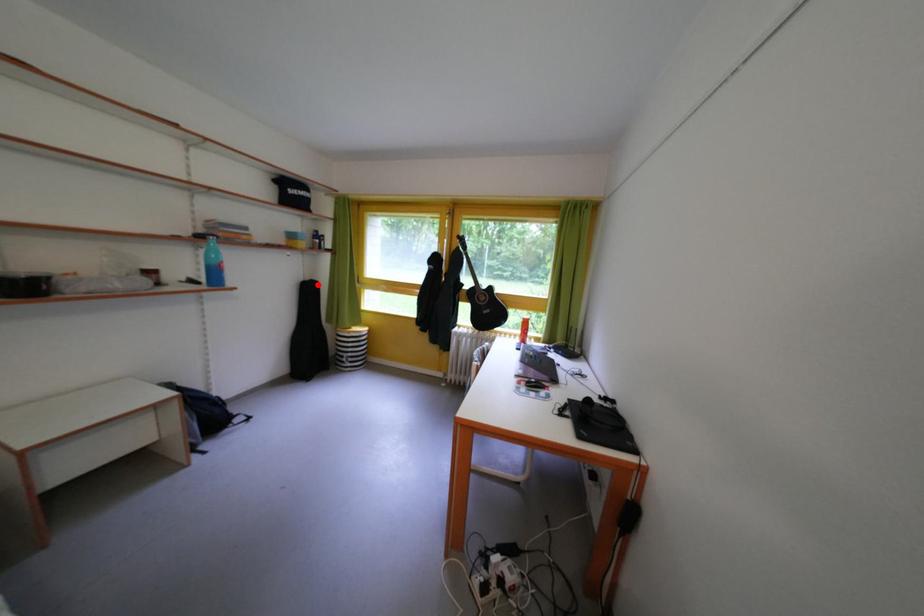
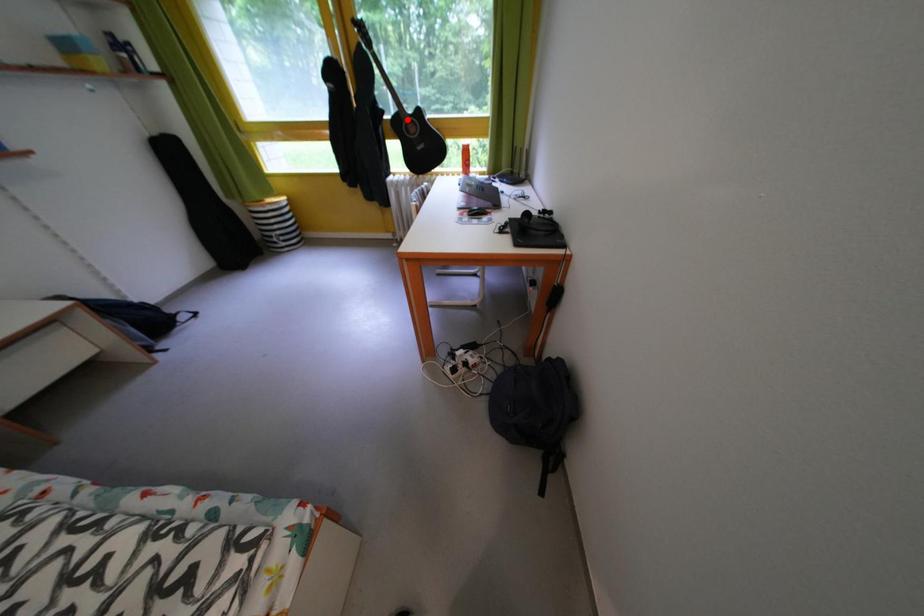
I am providing you with two images of the same scene from different viewpoints. A red point is marked on the first image and another point is marked on the second image. Does the point marked in image1 correspond to the same location as the one in image2?

No